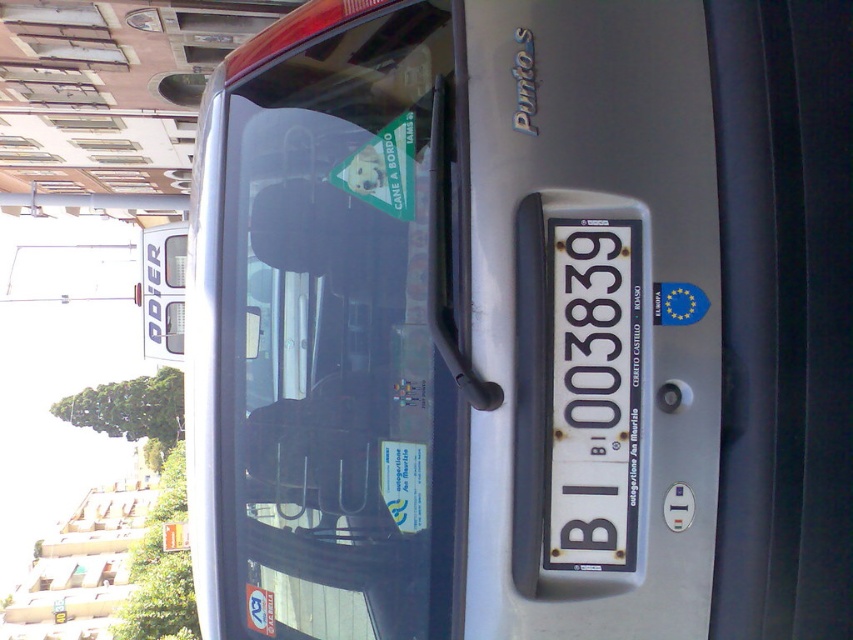
Consider the image. Does blue fabric flag at center appear on the right side of white glossy sticker at lower left?

Indeed, blue fabric flag at center is positioned on the right side of white glossy sticker at lower left.

Between blue fabric flag at center and white glossy sticker at lower left, which one is positioned higher?

Positioned higher is blue fabric flag at center.

You are a GUI agent. You are given a task and a screenshot of the screen. Output one action in this format:
    pyautogui.click(x=<x>, y=<y>)
    Task: Click on the blue fabric flag at center
    This screenshot has height=640, width=853.
    Given the screenshot: What is the action you would take?
    pyautogui.click(x=677, y=304)

Which is below, transparent glass windshield at center or blue fabric flag at center?

transparent glass windshield at center

At what (x,y) coordinates should I click in order to perform the action: click on transparent glass windshield at center. Please return your answer as a coordinate pair (x, y). The image size is (853, 640). Looking at the image, I should click on (334, 321).

Identify the location of transparent glass windshield at center. This screenshot has width=853, height=640. (334, 321).

Which is behind, point (560, 497) or point (701, 304)?

Positioned behind is point (560, 497).

Between white metallic license plate at center and blue fabric flag at center, which one has less height?

With less height is blue fabric flag at center.

I want to click on white metallic license plate at center, so pos(590,392).

Locate an element on the screen. This screenshot has height=640, width=853. white metallic license plate at center is located at coordinates (590, 392).